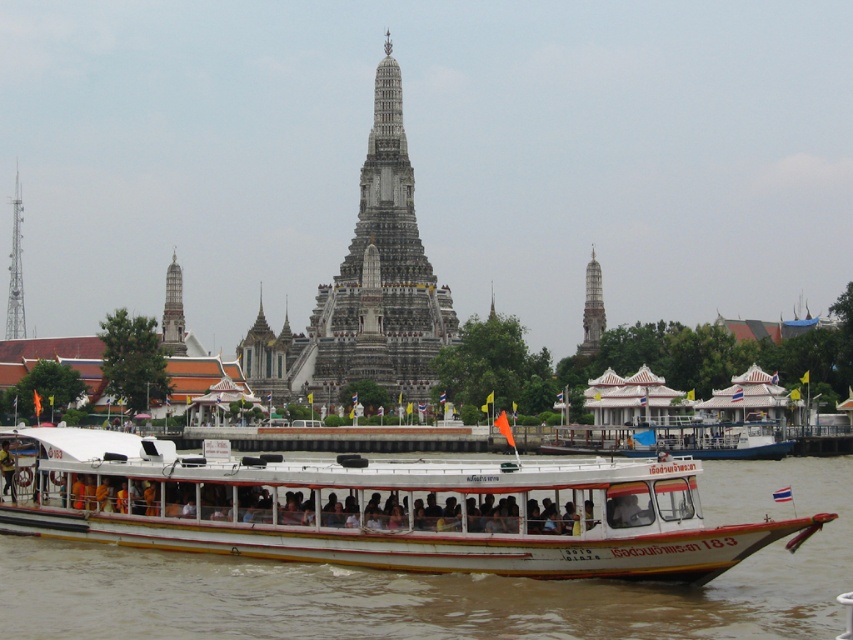
Which is above, metallic tower at left or white stone tower at right?

metallic tower at left is higher up.

Describe the element at coordinates (15, 273) in the screenshot. I see `metallic tower at left` at that location.

The height and width of the screenshot is (640, 853). Find the location of `metallic tower at left`. metallic tower at left is located at coordinates (15, 273).

Does white matte boat at center appear on the right side of white stone tower at left?

Correct, you'll find white matte boat at center to the right of white stone tower at left.

Which is behind, point (460, 556) or point (177, 296)?

The point (177, 296) is more distant.

Where is `white matte boat at center`? white matte boat at center is located at coordinates (387, 509).

Who is shorter, metallic tower at left or white stone tower at left?

With less height is white stone tower at left.

Can you confirm if metallic tower at left is smaller than white stone tower at left?

No.

Measure the distance between point (22, 314) and camera.

Point (22, 314) is 191.48 meters from camera.

The image size is (853, 640). I want to click on metallic tower at left, so click(15, 273).